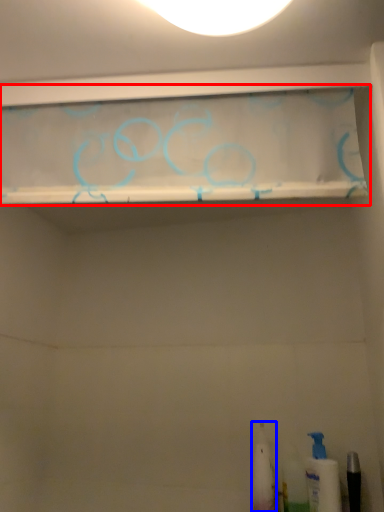
Question: Which object is further to the camera taking this photo, shelf (highlighted by a red box) or toiletry (highlighted by a blue box)?

Choices:
 (A) shelf
 (B) toiletry

Answer: (B)